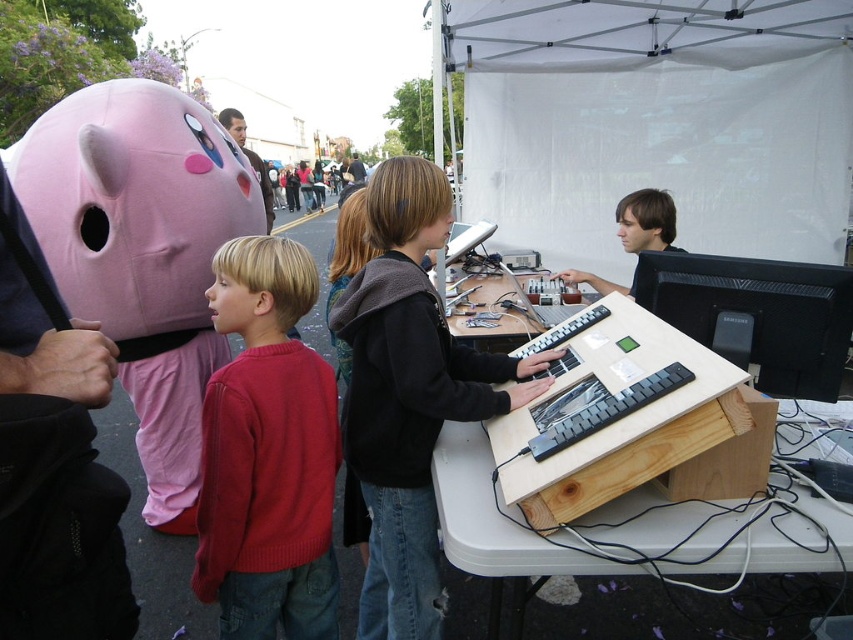
You are setting up a small booth for a childrens event. You have a black matte monitor at center and a matte black keyboard at center. Which object should you place on the lower shelf if you want to follow the rule that shorter items go below taller ones?

The black matte monitor at center has a lesser height compared to the matte black keyboard at center, so you should place the black matte monitor at center on the lower shelf.

You are a photographer trying to capture a clear shot of both the pink fabric mask at left and the black matte monitor at center. Since you can only focus on one object at a time, which object should you focus on first to ensure the other remains in the background?

You should focus on the pink fabric mask at left first because it is closer to you than the black matte monitor at center, so if you focus on the closer object, the farther one will naturally stay in focus as background.